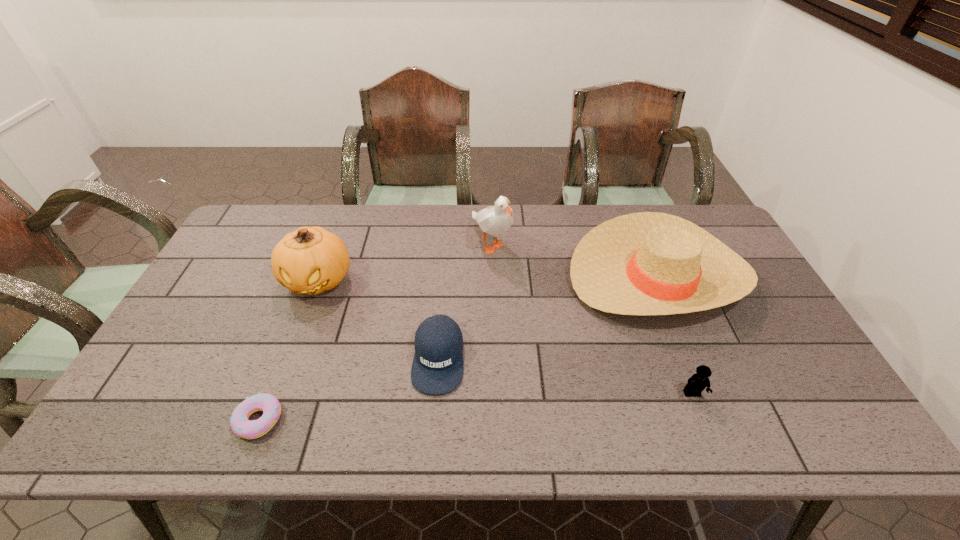
The height and width of the screenshot is (540, 960). Find the location of `free area in between the Lego and the doughnut`. free area in between the Lego and the doughnut is located at coordinates point(475,407).

At what (x,y) coordinates should I click in order to perform the action: click on free space between the Lego and the shortest object. Please return your answer as a coordinate pair (x, y). Looking at the image, I should click on (475, 407).

You are a GUI agent. You are given a task and a screenshot of the screen. Output one action in this format:
    pyautogui.click(x=<x>, y=<y>)
    Task: Click on the fourth closest object to the Lego
    The height and width of the screenshot is (540, 960).
    Given the screenshot: What is the action you would take?
    pyautogui.click(x=311, y=260)

This screenshot has width=960, height=540. I want to click on object that ranks as the fifth closest to the baseball cap, so click(698, 382).

Image resolution: width=960 pixels, height=540 pixels. Identify the location of vacant space that satisfies the following two spatial constraints: 1. at the beak of the sunhat; 2. on the left side of the third object from right to left. (492, 275).